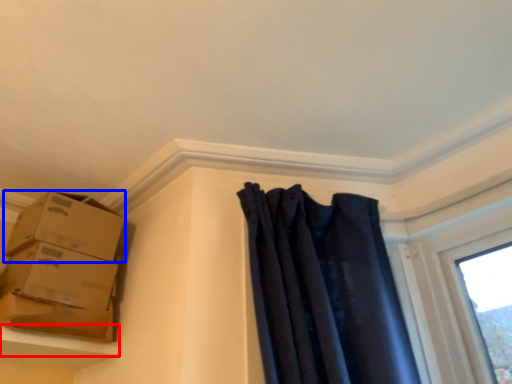
Question: Which of the following is the farthest to the observer, window sill (highlighted by a red box) or box (highlighted by a blue box)?

Choices:
 (A) window sill
 (B) box

Answer: (B)